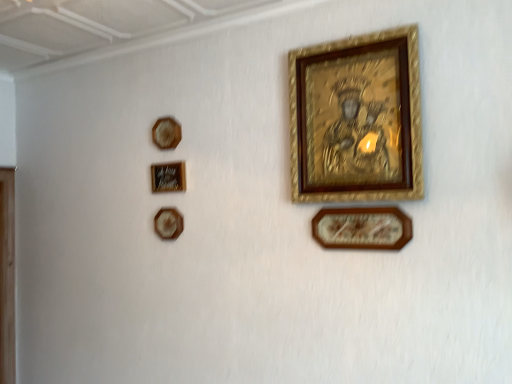
Question: Based on their sizes in the image, would you say matte black picture frame at upper left, the 3th picture frame when ordered from left to right, is bigger or smaller than gold textured picture frame at upper center, positioned as the second picture frame in right-to-left order?

Choices:
 (A) big
 (B) small

Answer: (B)

Question: From a real-world perspective, is matte black picture frame at upper left, the 3th picture frame when ordered from left to right, above or below gold textured picture frame at upper center, positioned as the second picture frame in right-to-left order?

Choices:
 (A) below
 (B) above

Answer: (A)

Question: Considering the real-world distances, which object is farthest from the matte black picture frame at upper left, the 3th picture frame in the right-to-left sequence?

Choices:
 (A) wooden plaque at upper left, placed as the 5th picture frame when sorted from right to left
 (B) gold textured picture frame at upper center, positioned as the second picture frame in right-to-left order
 (C) wooden picture frame at lower center, placed as the first picture frame when sorted from right to left
 (D) matte brown picture frame at upper left, the fourth picture frame when ordered from right to left

Answer: (C)

Question: Which is nearer to the wooden picture frame at lower center, which is counted as the fifth picture frame, starting from the left?

Choices:
 (A) matte brown picture frame at upper left, acting as the 2th picture frame starting from the left
 (B) gold textured picture frame at upper center, positioned as the second picture frame in right-to-left order
 (C) wooden plaque at upper left, placed as the 5th picture frame when sorted from right to left
 (D) matte black picture frame at upper left, the 3th picture frame when ordered from left to right

Answer: (B)